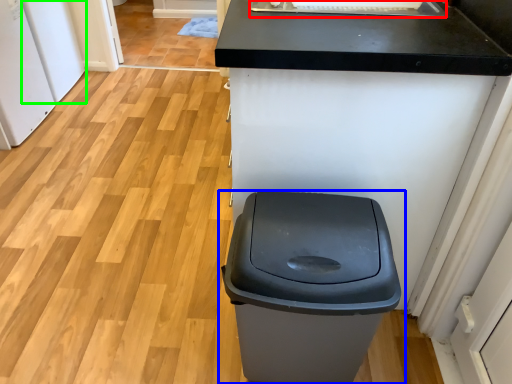
Question: Which object is the farthest from sink (highlighted by a red box)? Choose among these: waste container (highlighted by a blue box) or appliance (highlighted by a green box).

Choices:
 (A) waste container
 (B) appliance

Answer: (B)